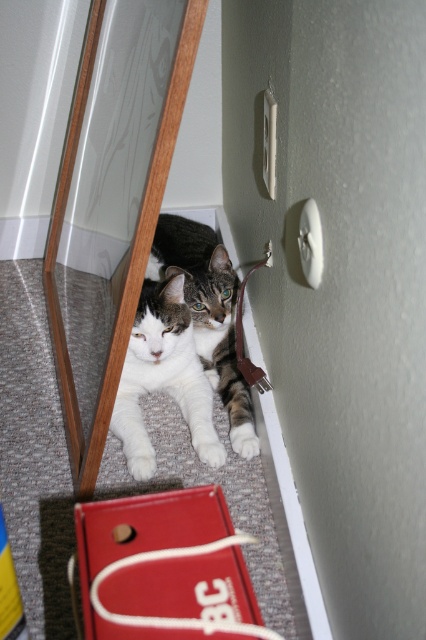
Question: Is white fur tabby cat at lower left wider than white fur cat at lower left?

Choices:
 (A) no
 (B) yes

Answer: (A)

Question: Which point appears farthest from the camera in this image?

Choices:
 (A) (207, 442)
 (B) (195, 266)
 (C) (57, 332)

Answer: (C)

Question: Does white fur tabby cat at lower left have a larger size compared to white fur cat at lower left?

Choices:
 (A) yes
 (B) no

Answer: (B)

Question: Can you confirm if wooden mirror at center is wider than white fur cat at lower left?

Choices:
 (A) yes
 (B) no

Answer: (A)

Question: Based on their relative distances, which object is farther from the wooden mirror at center?

Choices:
 (A) white fur cat at lower left
 (B) white fur tabby cat at lower left

Answer: (A)

Question: Which point is farther to the camera?

Choices:
 (A) wooden mirror at center
 (B) white fur cat at lower left

Answer: (B)